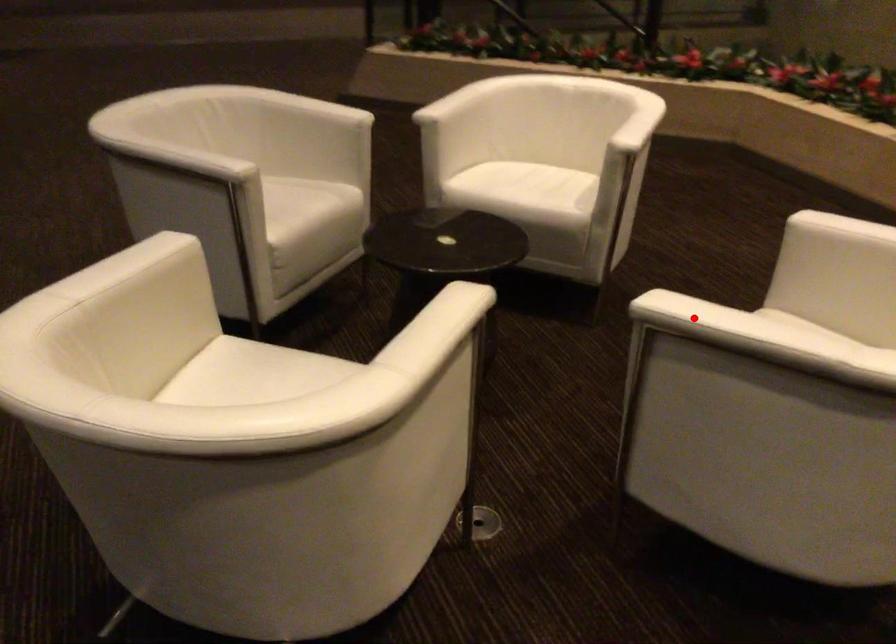
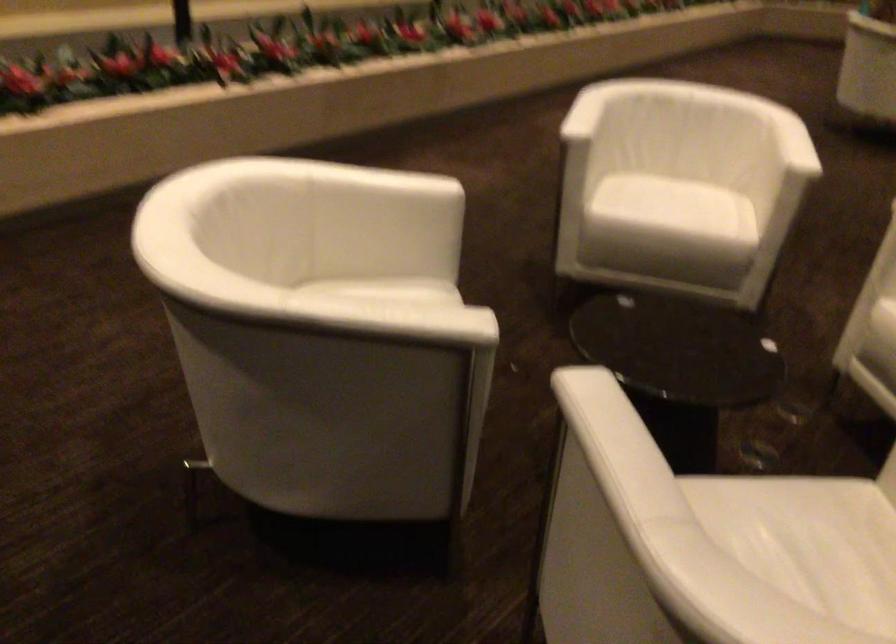
Question: I am providing you with two images of the same scene from different viewpoints. A red point is marked on the first image. Is the red point's position out of view in image 2?

Choices:
 (A) Yes
 (B) No

Answer: (A)